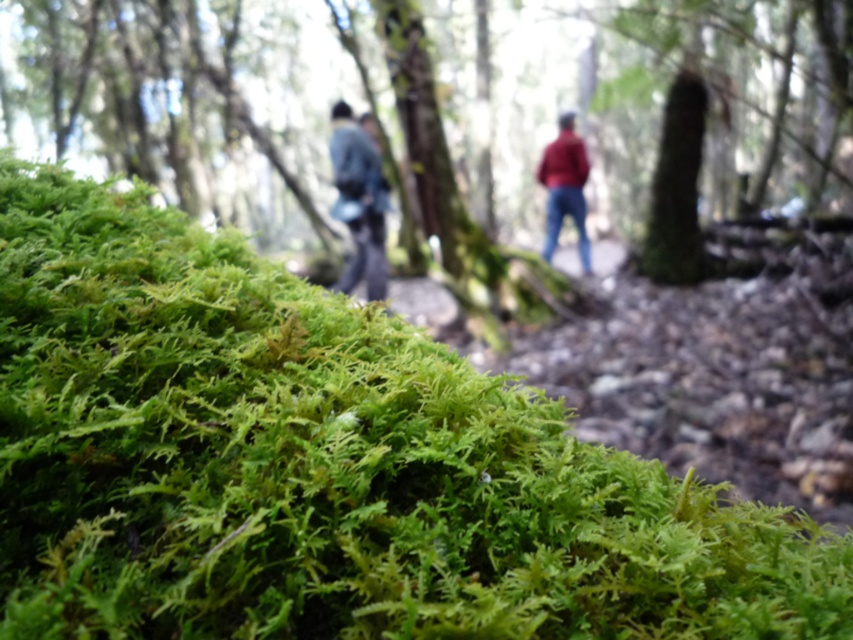
You are a photographer trying to capture both the denim jacket at center and the matte red jacket at center in a single frame. Given that your camera has a depth of field that can focus on objects within a 2.5 meter range, will both jackets be in focus?

The denim jacket at center and the matte red jacket at center are 2.42 meters apart from each other. Since the distance between them is within the camera sensor range of 2.5 meters, both jackets will be in focus in the photo.

Based on the photo, you are a photographer trying to capture a clear shot of both the denim jacket at center and the matte red jacket at center. Since the camera focuses on the foreground moss, which jacket might appear more blurred in the photo?

The matte red jacket at center might appear more blurred because the denim jacket at center is wider and could be closer to the camera focus point, making it less blurred compared to the narrower matte red jacket at center.

Looking at this image, you are a hiker carrying a backpack that is 3 inches wide. You want to walk between the denim jacket at center and the dark blue jacket at center. Can your backpack fit through the space between them?

The distance between the denim jacket at center and the dark blue jacket at center is 4.55 inches. Since your backpack is 3 inches wide, it should fit through the space between them.